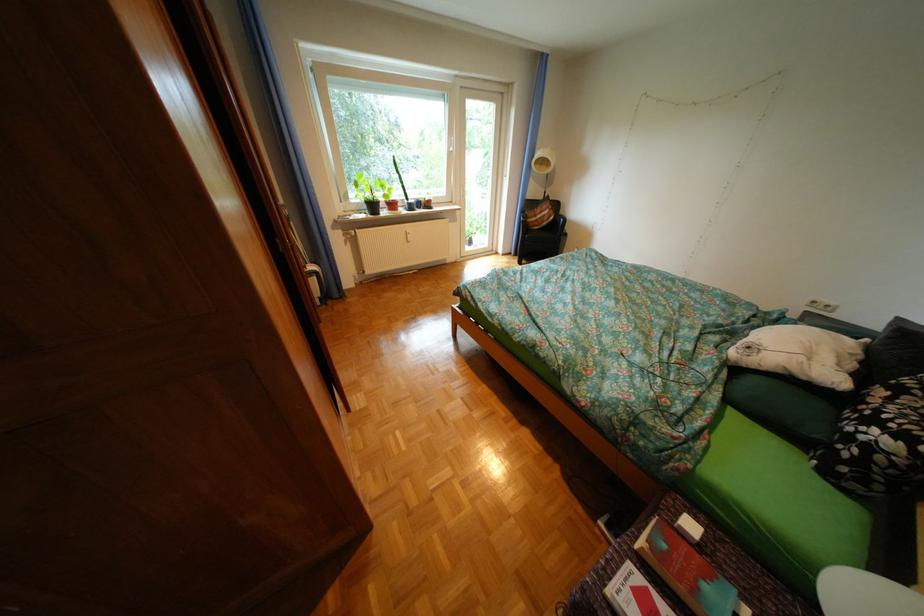
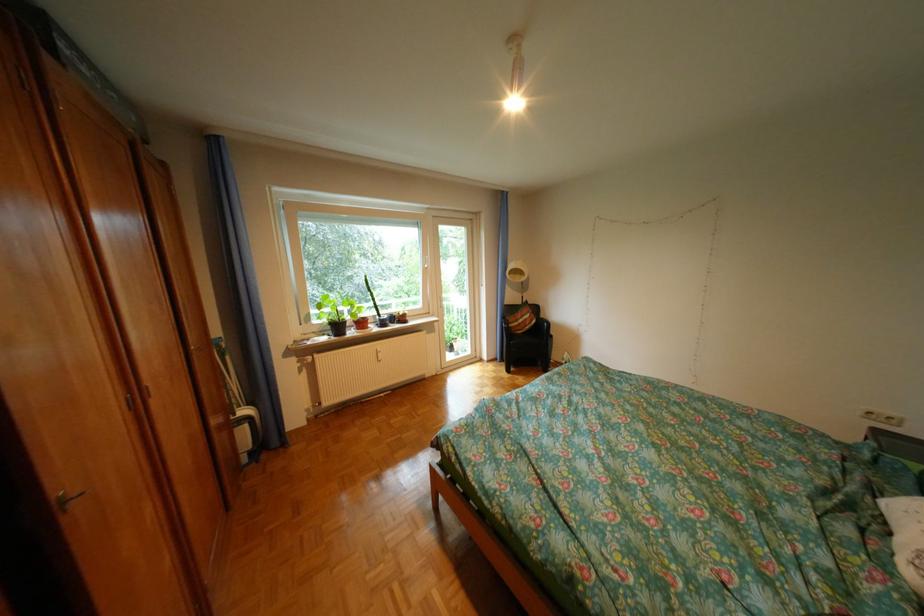
Question: The images are taken continuously from a first-person perspective. In which direction are you moving?

Choices:
 (A) Left
 (B) Right
 (C) Forward
 (D) Backward

Answer: (C)